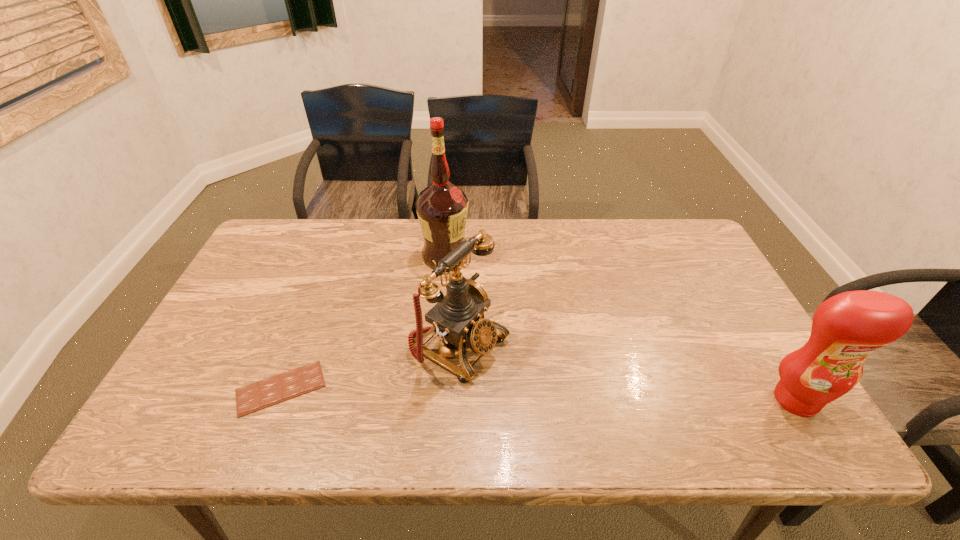
Find the location of a particular element. The image size is (960, 540). object that is at the near right corner is located at coordinates (846, 328).

The image size is (960, 540). I want to click on blank space at the far edge of the desktop, so click(402, 220).

Find the location of `free space at the near edge of the desktop`. free space at the near edge of the desktop is located at coordinates (427, 404).

In the image, there is a desktop. At what (x,y) coordinates should I click in order to perform the action: click on vacant space at the left edge. Please return your answer as a coordinate pair (x, y). This screenshot has height=540, width=960. Looking at the image, I should click on (215, 370).

At what (x,y) coordinates should I click in order to perform the action: click on vacant space at the right edge. Please return your answer as a coordinate pair (x, y). The height and width of the screenshot is (540, 960). Looking at the image, I should click on (715, 298).

Locate an element on the screen. free space at the far right corner of the desktop is located at coordinates (681, 245).

Find the location of `vacant region between the chocolate bar and the tallest object`. vacant region between the chocolate bar and the tallest object is located at coordinates (363, 322).

Image resolution: width=960 pixels, height=540 pixels. What are the coordinates of `vacant area that lies between the chocolate bar and the telephone` in the screenshot? It's located at pos(371,366).

In order to click on free space between the telephone and the chocolate bar in this screenshot , I will do `click(371, 366)`.

Locate an element on the screen. The image size is (960, 540). free space between the telephone and the condiment is located at coordinates (628, 372).